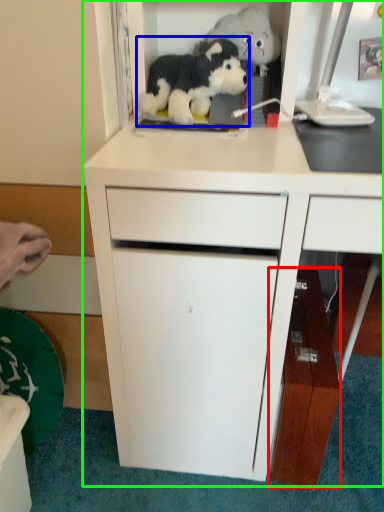
Question: Which is farther away from cabinetry (highlighted by a red box)? toy (highlighted by a blue box) or cabinetry (highlighted by a green box)?

Choices:
 (A) toy
 (B) cabinetry

Answer: (A)